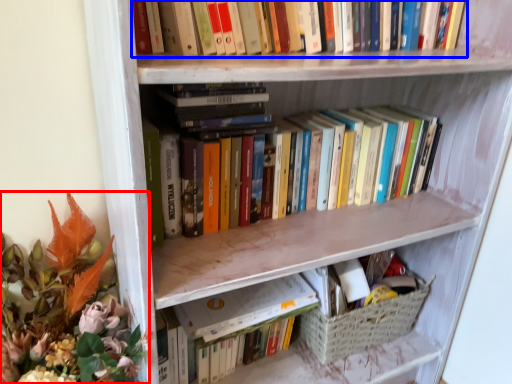
Question: Which point is closer to the camera, floral arrangement (highlighted by a red box) or book (highlighted by a blue box)?

Choices:
 (A) floral arrangement
 (B) book

Answer: (A)